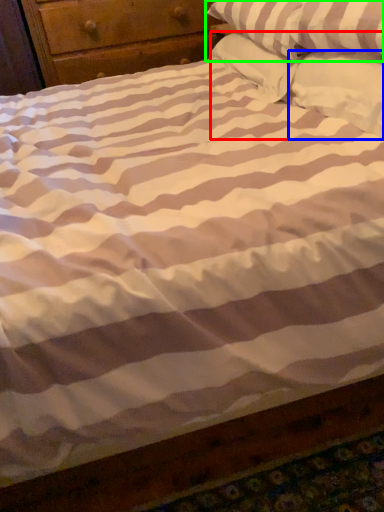
Question: Which object is positioned farthest from pillow (highlighted by a red box)? Select from pillow (highlighted by a blue box) and pillow (highlighted by a green box).

Choices:
 (A) pillow
 (B) pillow

Answer: (B)